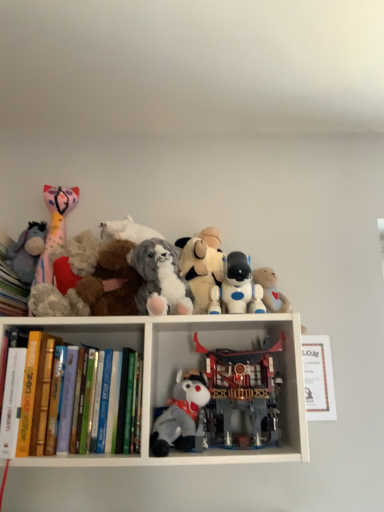
Question: Can you confirm if fluffy gray plush at center, placed as the fifth toy when sorted from right to left, is shorter than fluffy pink and white plush toy at left, arranged as the 2th toy when viewed from the left?

Choices:
 (A) yes
 (B) no

Answer: (A)

Question: Is fluffy gray plush at center, which ranks as the fourth toy in left-to-right order, with fluffy pink and white plush toy at left, the 7th toy in the right-to-left sequence?

Choices:
 (A) no
 (B) yes

Answer: (A)

Question: Is fluffy gray plush at center, which ranks as the fourth toy in left-to-right order, located outside fluffy pink and white plush toy at left, arranged as the 2th toy when viewed from the left?

Choices:
 (A) no
 (B) yes

Answer: (B)

Question: Considering the relative sizes of fluffy gray plush at center, which ranks as the fourth toy in left-to-right order, and fluffy pink and white plush toy at left, the 7th toy in the right-to-left sequence, in the image provided, is fluffy gray plush at center, which ranks as the fourth toy in left-to-right order, smaller than fluffy pink and white plush toy at left, the 7th toy in the right-to-left sequence,?

Choices:
 (A) no
 (B) yes

Answer: (B)

Question: Can you confirm if fluffy gray plush at center, placed as the fifth toy when sorted from right to left, is taller than fluffy pink and white plush toy at left, the 7th toy in the right-to-left sequence?

Choices:
 (A) yes
 (B) no

Answer: (B)

Question: Would you say plush purple at left, which is the 1th toy from left to right, is inside or outside fluffy beige stuffed animal at center, positioned as the 5th toy in left-to-right order?

Choices:
 (A) outside
 (B) inside

Answer: (A)

Question: In terms of width, does plush purple at left, which is the 1th toy from left to right, look wider or thinner when compared to fluffy beige stuffed animal at center, the fourth toy positioned from the right?

Choices:
 (A) wide
 (B) thin

Answer: (B)

Question: Is point 24,245 closer or farther from the camera than point 183,245?

Choices:
 (A) farther
 (B) closer

Answer: (B)

Question: From the image's perspective, is plush purple at left, acting as the eighth toy starting from the right, located above or below fluffy beige stuffed animal at center, the fourth toy positioned from the right?

Choices:
 (A) above
 (B) below

Answer: (A)

Question: From a real-world perspective, is fluffy gray plush at center, marked as the sixth toy in a right-to-left arrangement, physically located above or below fluffy beige stuffed animal at center, positioned as the 5th toy in left-to-right order?

Choices:
 (A) below
 (B) above

Answer: (A)

Question: Would you say fluffy gray plush at center, which ranks as the 3th toy in left-to-right order, is inside or outside fluffy beige stuffed animal at center, positioned as the 5th toy in left-to-right order?

Choices:
 (A) outside
 (B) inside

Answer: (A)

Question: Considering the positions of fluffy gray plush at center, marked as the sixth toy in a right-to-left arrangement, and fluffy beige stuffed animal at center, the fourth toy positioned from the right, in the image, is fluffy gray plush at center, marked as the sixth toy in a right-to-left arrangement, taller or shorter than fluffy beige stuffed animal at center, the fourth toy positioned from the right,?

Choices:
 (A) short
 (B) tall

Answer: (A)

Question: Is fluffy gray plush at center, marked as the sixth toy in a right-to-left arrangement, bigger or smaller than fluffy beige stuffed animal at center, positioned as the 5th toy in left-to-right order?

Choices:
 (A) big
 (B) small

Answer: (B)

Question: Looking at the image, does white matte books at upper left seem bigger or smaller compared to white plastic robot at center, arranged as the second toy when viewed from the right?

Choices:
 (A) small
 (B) big

Answer: (B)

Question: Considering their positions, is white matte books at upper left located in front of or behind white plastic robot at center, positioned as the 7th toy in left-to-right order?

Choices:
 (A) front
 (B) behind

Answer: (A)